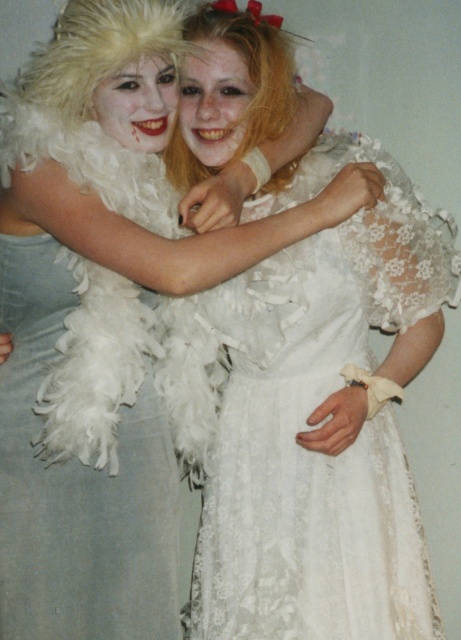
You are standing at the origin point in a coordinate system where the image is represented. You need to move towards the point labeled point (35,493) and point (242,24). Which point should you reach first if you move straight ahead?

Point (35,493) is in front of point (242,24), so you should reach point (35,493) first.